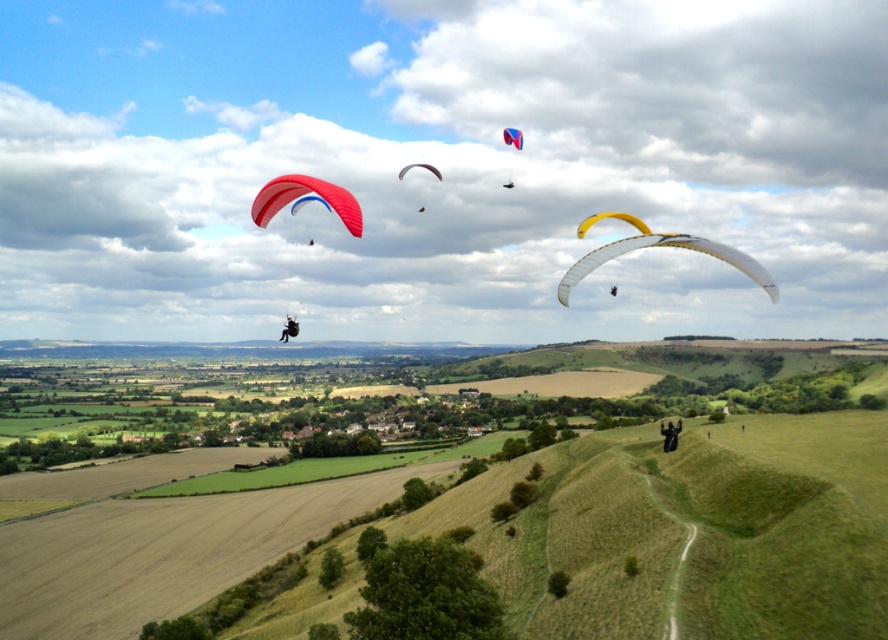
You are a photographer trying to capture both the yellow matte paraglider at center and the black fabric parachute at center in a single shot. Based on their positions, which paraglider should you adjust your camera to focus on first to ensure both are in frame?

The yellow matte paraglider at center is positioned on the right side of black fabric parachute at center, so you should focus on the black fabric parachute at center first to ensure both are captured in the frame.

You are a paraglider pilot preparing to land on a grassy field. You notice two points marked as potential landing spots. The first point is at coordinates point (661, 432) and the second is at point (510, 134). Based on the scene, which point is closer to the paraglider currently in flight?

Point (510, 134) is closer to the paraglider currently in flight because according to the description, point (661, 432) is behind point (510, 134), meaning the latter is nearer to the paraglider.

You are a photographer aiming to capture the yellow matte paraglider at center in your shot. Given that your camera has a maximum focus range of 200 feet, will you be able to focus on the paraglider?

The yellow matte paraglider at center is 186.92 feet away from the camera. Since this distance is within the camera maximum focus range of 200 feet, the photographer can focus on the paraglider.